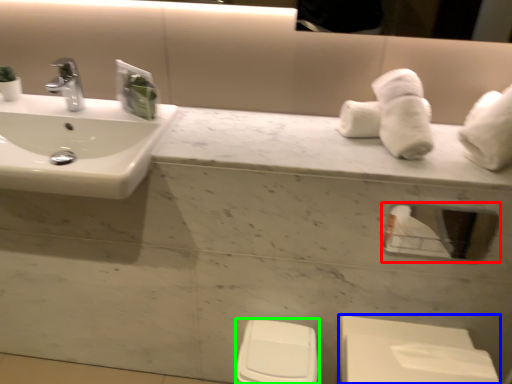
Question: Based on their relative distances, which object is nearer to mirror (highlighted by a red box)? Choose from porcelain (highlighted by a blue box) and toilet bowl (highlighted by a green box).

Choices:
 (A) porcelain
 (B) toilet bowl

Answer: (A)